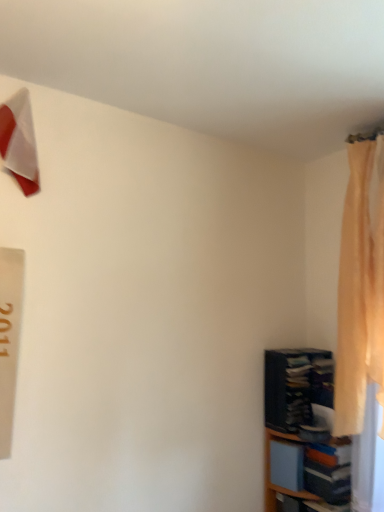
Question: Considering the relative sizes of silky beige curtain at right and white glossy triangle at upper left in the image provided, is silky beige curtain at right bigger than white glossy triangle at upper left?

Choices:
 (A) no
 (B) yes

Answer: (B)

Question: Would you say silky beige curtain at right contains white glossy triangle at upper left?

Choices:
 (A) no
 (B) yes

Answer: (A)

Question: Does silky beige curtain at right appear on the right side of white glossy triangle at upper left?

Choices:
 (A) no
 (B) yes

Answer: (B)

Question: Is silky beige curtain at right not within white glossy triangle at upper left?

Choices:
 (A) yes
 (B) no

Answer: (A)

Question: From the image's perspective, would you say silky beige curtain at right is positioned over white glossy triangle at upper left?

Choices:
 (A) no
 (B) yes

Answer: (A)

Question: Is silky beige curtain at right inside or outside of white glossy triangle at upper left?

Choices:
 (A) outside
 (B) inside

Answer: (A)

Question: Is silky beige curtain at right taller or shorter than white glossy triangle at upper left?

Choices:
 (A) tall
 (B) short

Answer: (A)

Question: In terms of width, does silky beige curtain at right look wider or thinner when compared to white glossy triangle at upper left?

Choices:
 (A) wide
 (B) thin

Answer: (A)

Question: From the image's perspective, is silky beige curtain at right above or below white glossy triangle at upper left?

Choices:
 (A) above
 (B) below

Answer: (B)

Question: In terms of width, does dark blue fabric bookshelf at lower right look wider or thinner when compared to white glossy triangle at upper left?

Choices:
 (A) thin
 (B) wide

Answer: (B)

Question: Is dark blue fabric bookshelf at lower right in front of or behind white glossy triangle at upper left in the image?

Choices:
 (A) front
 (B) behind

Answer: (B)

Question: From their relative heights in the image, would you say dark blue fabric bookshelf at lower right is taller or shorter than white glossy triangle at upper left?

Choices:
 (A) short
 (B) tall

Answer: (A)

Question: Is dark blue fabric bookshelf at lower right bigger or smaller than white glossy triangle at upper left?

Choices:
 (A) big
 (B) small

Answer: (A)

Question: Is silky beige curtain at right situated inside wooden bookshelf at lower right or outside?

Choices:
 (A) inside
 (B) outside

Answer: (B)

Question: Does point (375, 347) appear closer or farther from the camera than point (264, 418)?

Choices:
 (A) farther
 (B) closer

Answer: (B)